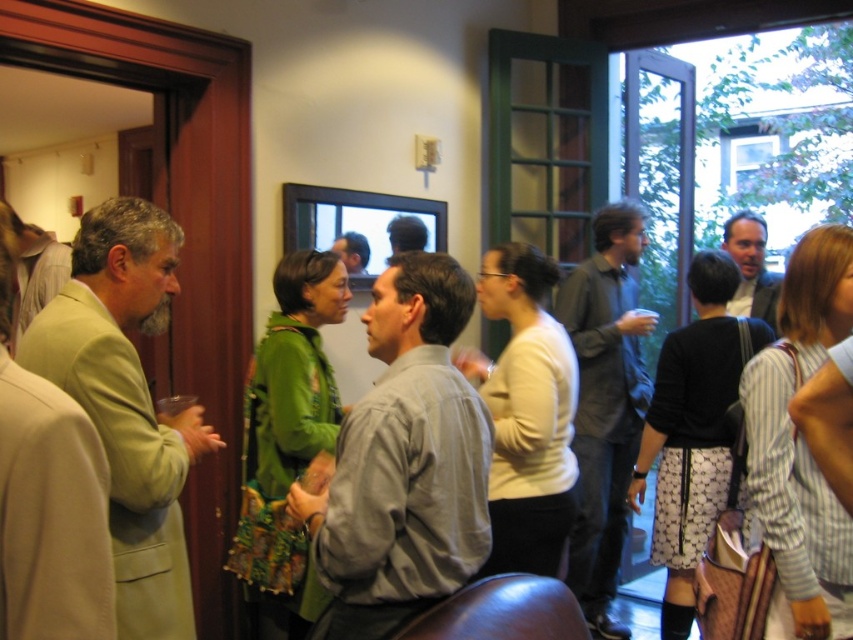
Question: Which of these objects is positioned farthest from the smooth gray suit at center?

Choices:
 (A) dark gray suit at center
 (B) gray cotton shirt at center
 (C) light green wool coat at left

Answer: (C)

Question: Observing the image, what is the correct spatial positioning of dark gray suit at center in reference to smooth gray suit at center?

Choices:
 (A) above
 (B) below

Answer: (B)

Question: Based on their relative distances, which object is farther from the smooth gray suit at center?

Choices:
 (A) dark gray suit at center
 (B) light green wool coat at left

Answer: (B)

Question: Is light green wool coat at left further to camera compared to smooth gray suit at center?

Choices:
 (A) no
 (B) yes

Answer: (A)

Question: Can you confirm if light green wool coat at left is smaller than smooth gray suit at center?

Choices:
 (A) yes
 (B) no

Answer: (B)

Question: Among these objects, which one is nearest to the camera?

Choices:
 (A) light green wool coat at left
 (B) smooth gray suit at center
 (C) dark gray suit at center

Answer: (A)